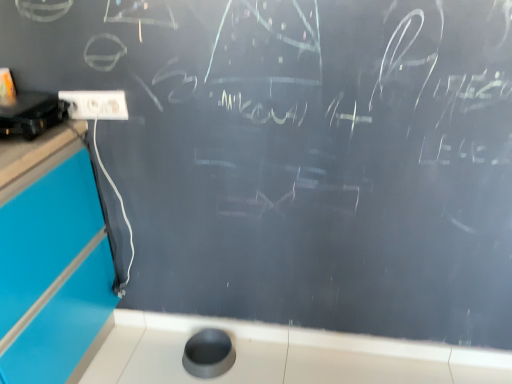
This screenshot has height=384, width=512. I want to click on free space above white glossy counter top at lower center (from a real-world perspective), so click(315, 329).